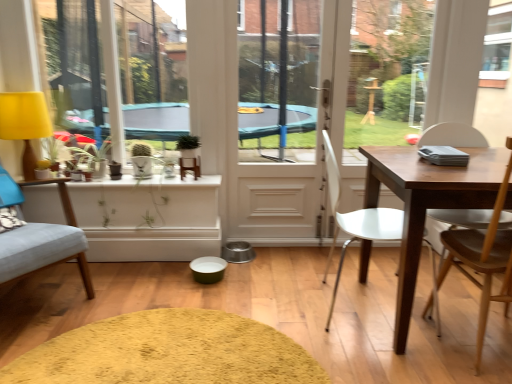
Question: Is yellow fabric lampshade at left further to camera compared to soft yellow rug at center?

Choices:
 (A) yes
 (B) no

Answer: (A)

Question: Would you say yellow fabric lampshade at left is outside soft yellow rug at center?

Choices:
 (A) no
 (B) yes

Answer: (B)

Question: Could you tell me if yellow fabric lampshade at left is turned towards soft yellow rug at center?

Choices:
 (A) no
 (B) yes

Answer: (A)

Question: Is yellow fabric lampshade at left far away from soft yellow rug at center?

Choices:
 (A) yes
 (B) no

Answer: (A)

Question: Does yellow fabric lampshade at left have a larger size compared to soft yellow rug at center?

Choices:
 (A) no
 (B) yes

Answer: (B)

Question: From a real-world perspective, is yellow fabric lampshade at left located higher than soft yellow rug at center?

Choices:
 (A) yes
 (B) no

Answer: (A)

Question: Considering the relative positions of green matte plant at upper center and white plastic chair at center, the 2th chair when ordered from right to left, in the image provided, is green matte plant at upper center to the left of white plastic chair at center, the 2th chair when ordered from right to left, from the viewer's perspective?

Choices:
 (A) no
 (B) yes

Answer: (B)

Question: Is white plastic chair at center, positioned as the second chair in left-to-right order, inside green matte plant at upper center?

Choices:
 (A) no
 (B) yes

Answer: (A)

Question: From the image's perspective, is green matte plant at upper center under white plastic chair at center, the 2th chair when ordered from right to left?

Choices:
 (A) no
 (B) yes

Answer: (A)

Question: From the image's perspective, would you say green matte plant at upper center is positioned over white plastic chair at center, positioned as the second chair in left-to-right order?

Choices:
 (A) yes
 (B) no

Answer: (A)

Question: Can you confirm if green matte plant at upper center is bigger than white plastic chair at center, positioned as the second chair in left-to-right order?

Choices:
 (A) yes
 (B) no

Answer: (B)

Question: Does green matte plant at upper center have a greater height compared to white plastic chair at center, positioned as the second chair in left-to-right order?

Choices:
 (A) yes
 (B) no

Answer: (B)

Question: Considering the relative sizes of yellow fabric lampshade at left and white plastic chair at center, the 2th chair when ordered from right to left, in the image provided, is yellow fabric lampshade at left wider than white plastic chair at center, the 2th chair when ordered from right to left,?

Choices:
 (A) yes
 (B) no

Answer: (B)